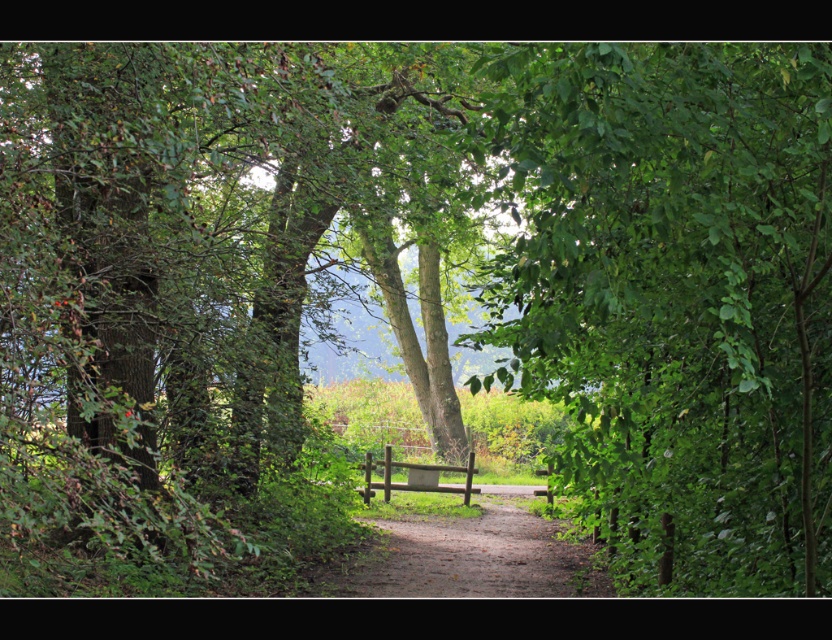
You are standing on the dirt path and want to sit down. There is a green leafy tree at center and a wooden bench at center. Which object is closer to your right side?

The green leafy tree at center is to the right of the wooden bench at center, so if you are facing the path, the green leafy tree at center would be closer to your right side.

You are standing at the start of the dirt path and see the green leafy tree at center and the wooden bench at center ahead. Which object will you encounter first as you walk along the path?

The green leafy tree at center will be encountered first because it is closer to the viewer than the wooden bench at center.